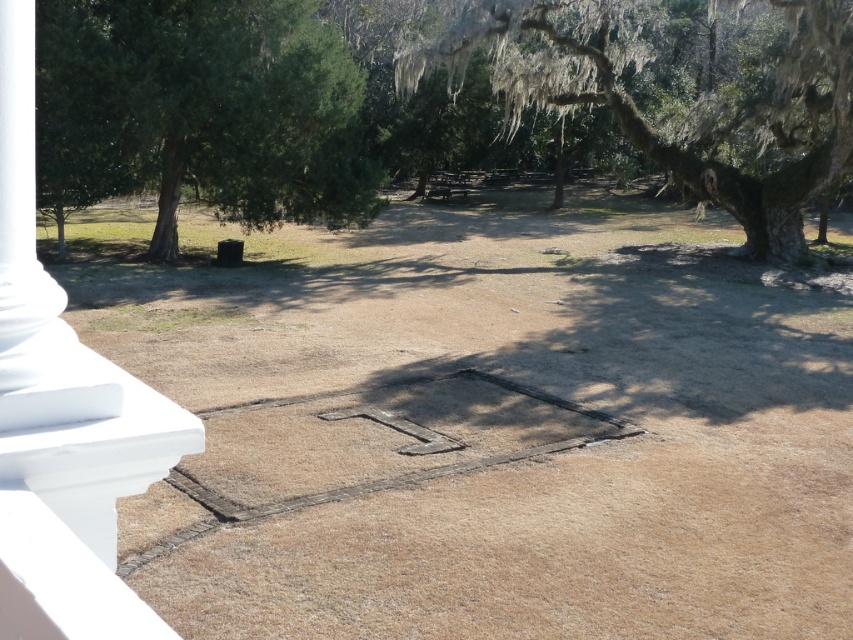
Who is positioned more to the left, green leafy tree at upper left or green mossy tree at upper right?

Positioned to the left is green leafy tree at upper left.

The width and height of the screenshot is (853, 640). Identify the location of green leafy tree at upper left. (199, 112).